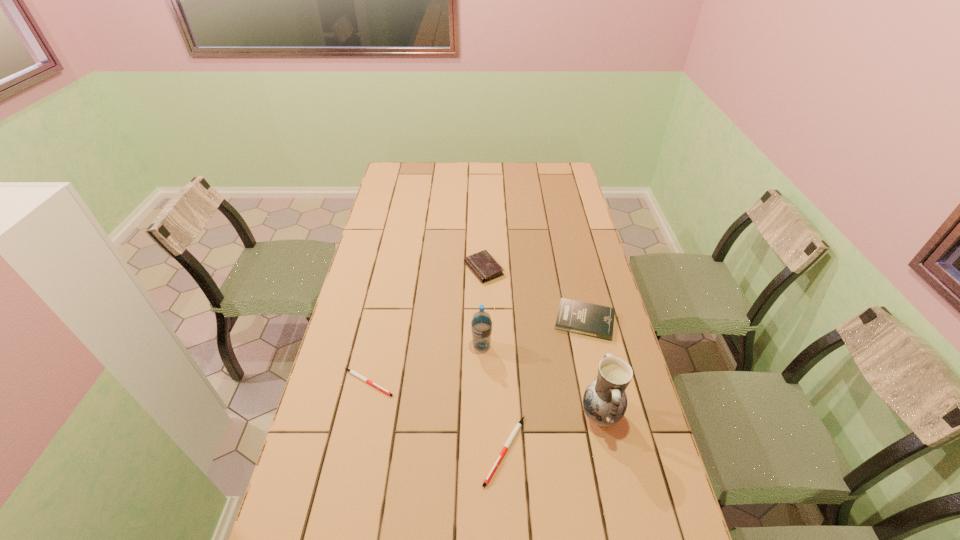
Where is `free point between the book and the shortest object`? The width and height of the screenshot is (960, 540). free point between the book and the shortest object is located at coordinates (476, 352).

This screenshot has height=540, width=960. I want to click on blank region between the taller pen and the pottery, so coord(552,432).

This screenshot has height=540, width=960. Find the location of `unoccupied position between the pottery and the farthest object`. unoccupied position between the pottery and the farthest object is located at coordinates (542, 342).

This screenshot has height=540, width=960. In order to click on object that is the fifth nearest to the book in this screenshot , I will do `click(352, 372)`.

You are a GUI agent. You are given a task and a screenshot of the screen. Output one action in this format:
    pyautogui.click(x=<x>, y=<y>)
    Task: Click on the closest object to the book
    The height and width of the screenshot is (540, 960).
    Given the screenshot: What is the action you would take?
    pyautogui.click(x=482, y=264)

Where is `vacant space that satisfies the following two spatial constraints: 1. on either side of the pottery; 2. on the clicker of the taller pen`? The height and width of the screenshot is (540, 960). vacant space that satisfies the following two spatial constraints: 1. on either side of the pottery; 2. on the clicker of the taller pen is located at coordinates (608, 450).

Find the location of a particular element. vacant area that satisfies the following two spatial constraints: 1. on either side of the pottery; 2. on the clicker of the nearer pen is located at coordinates (608, 450).

The image size is (960, 540). Find the location of `vacant space that satisfies the following two spatial constraints: 1. on the back side of the book; 2. on the left side of the water bottle`. vacant space that satisfies the following two spatial constraints: 1. on the back side of the book; 2. on the left side of the water bottle is located at coordinates (482, 321).